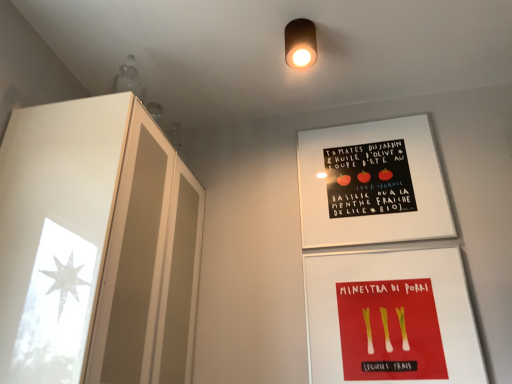
Question: From the image's perspective, is matte brown cylinder at upper center positioned above or below white matte poster at upper center?

Choices:
 (A) above
 (B) below

Answer: (A)

Question: Is point (295, 54) closer or farther from the camera than point (415, 228)?

Choices:
 (A) farther
 (B) closer

Answer: (B)

Question: Which object is the farthest from the red matte leeks at lower center?

Choices:
 (A) white matte poster at upper center
 (B) frosted glass cabinet at left
 (C) matte brown cylinder at upper center

Answer: (C)

Question: Which is nearer to the red matte leeks at lower center?

Choices:
 (A) white matte poster at upper center
 (B) frosted glass cabinet at left
 (C) matte brown cylinder at upper center

Answer: (A)